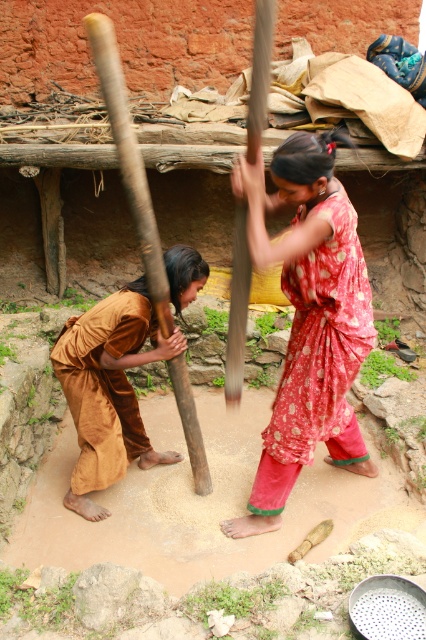
Can you confirm if red printed dress at center is positioned above brown silk robe at lower left?

Yes.

Who is lower down, red printed dress at center or brown silk robe at lower left?

Positioned lower is brown silk robe at lower left.

Is point (344, 369) farther from viewer compared to point (111, 445)?

That is False.

Identify the location of red printed dress at center. The width and height of the screenshot is (426, 640). (308, 321).